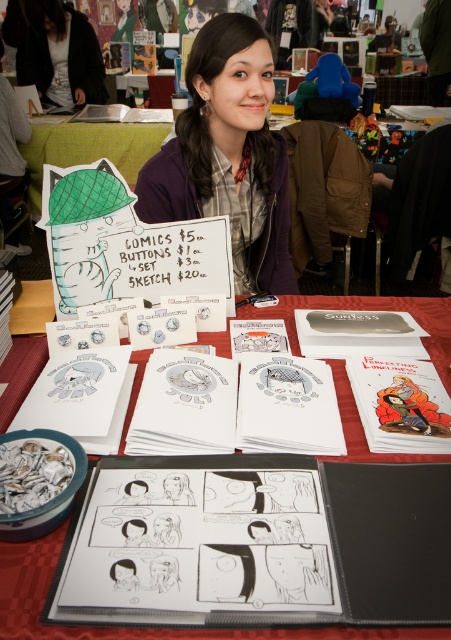
You are a customer at the comic fair and want to buy the black ink drawing of a person at center. The vendor tells you that the drawing is sold with its backing paper. If you want to frame it, will the black paper at center be larger than the drawing itself?

Yes, the black paper at center is larger than the black ink drawing of a person at center because the drawing is narrower than the paper.